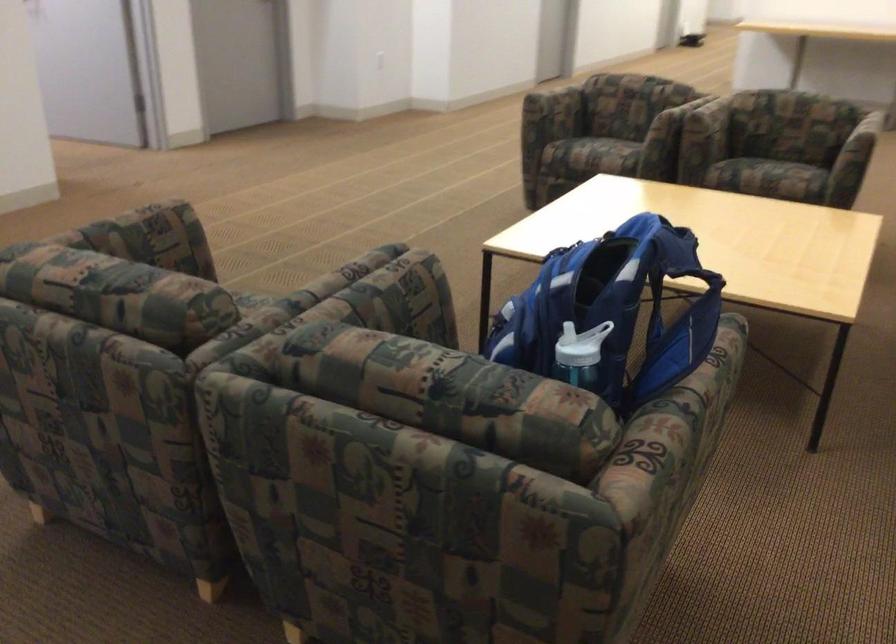
Where would you lift the blue backpack handle? Please return your answer as a coordinate pair (x, y).

(613, 310)